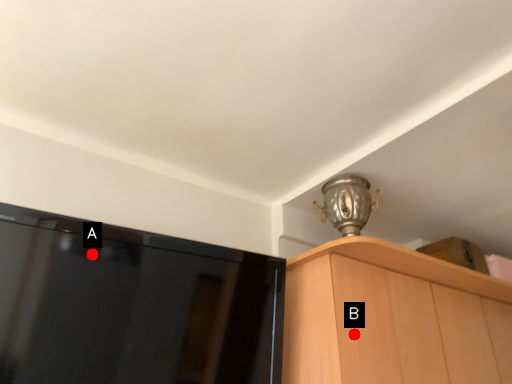
Question: Two points are circled on the image, labeled by A and B beside each circle. Which point is farther to the camera?

Choices:
 (A) A is further
 (B) B is further

Answer: (B)